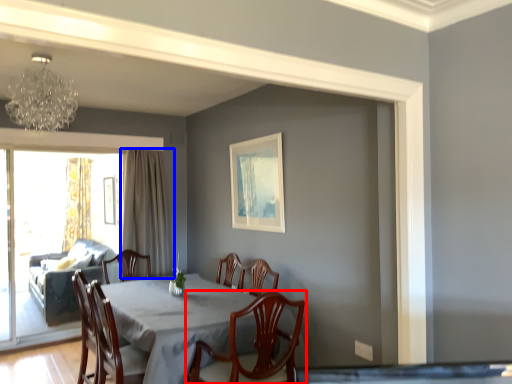
Question: Which point is closer to the camera, chair (highlighted by a red box) or curtain (highlighted by a blue box)?

Choices:
 (A) chair
 (B) curtain

Answer: (A)